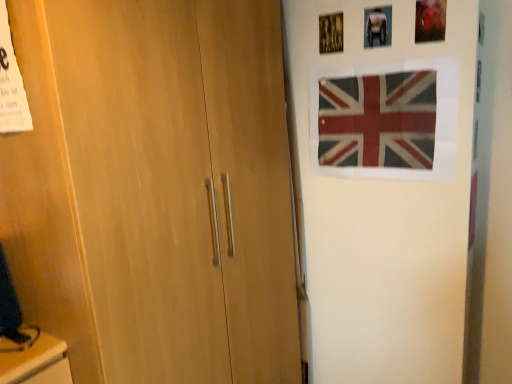
Question: In the image, is white glossy picture frame at upper center positioned in front of or behind textured fabric flag at upper right?

Choices:
 (A) front
 (B) behind

Answer: (B)

Question: Is white glossy picture frame at upper center bigger or smaller than textured fabric flag at upper right?

Choices:
 (A) big
 (B) small

Answer: (B)

Question: Considering the positions of white glossy picture frame at upper center and textured fabric flag at upper right in the image, is white glossy picture frame at upper center wider or thinner than textured fabric flag at upper right?

Choices:
 (A) wide
 (B) thin

Answer: (A)

Question: Considering the positions of textured fabric flag at upper right and white glossy picture frame at upper center in the image, is textured fabric flag at upper right taller or shorter than white glossy picture frame at upper center?

Choices:
 (A) tall
 (B) short

Answer: (A)

Question: From a real-world perspective, is textured fabric flag at upper right positioned above or below white glossy picture frame at upper center?

Choices:
 (A) above
 (B) below

Answer: (B)

Question: From the image's perspective, is textured fabric flag at upper right positioned above or below white glossy picture frame at upper center?

Choices:
 (A) below
 (B) above

Answer: (A)

Question: In terms of size, does textured fabric flag at upper right appear bigger or smaller than white glossy picture frame at upper center?

Choices:
 (A) small
 (B) big

Answer: (B)